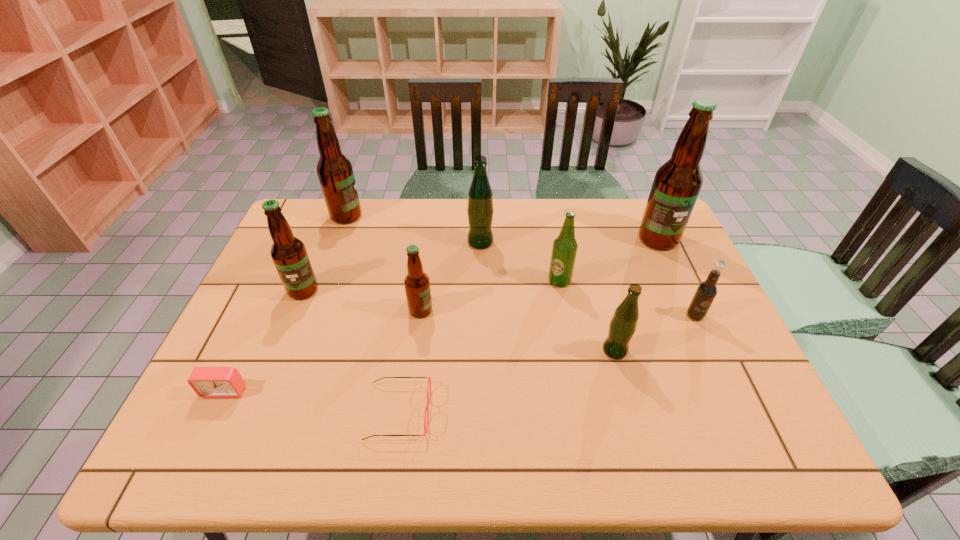
The height and width of the screenshot is (540, 960). I want to click on the fifth beer bottle from right to left, so click(417, 284).

Locate an element on the screen. the rightmost green beer bottle is located at coordinates (622, 327).

Identify the location of the third nearest object. The width and height of the screenshot is (960, 540). (622, 327).

In order to click on the third shortest object in this screenshot , I will do `click(707, 290)`.

Identify the location of alarm clock. (208, 382).

At what (x,y) coordinates should I click in order to perform the action: click on the ninth tallest object. Please return your answer as a coordinate pair (x, y). The height and width of the screenshot is (540, 960). Looking at the image, I should click on (208, 382).

Identify the location of spectacles. (429, 380).

Identify the location of the shortest object. Image resolution: width=960 pixels, height=540 pixels. (429, 380).

Identify the location of free space located 0.350m on the label of the rightmost beer bottle. (705, 341).

Where is `vacant space situated 0.370m on the label of the second tallest object`? This screenshot has width=960, height=540. vacant space situated 0.370m on the label of the second tallest object is located at coordinates (469, 216).